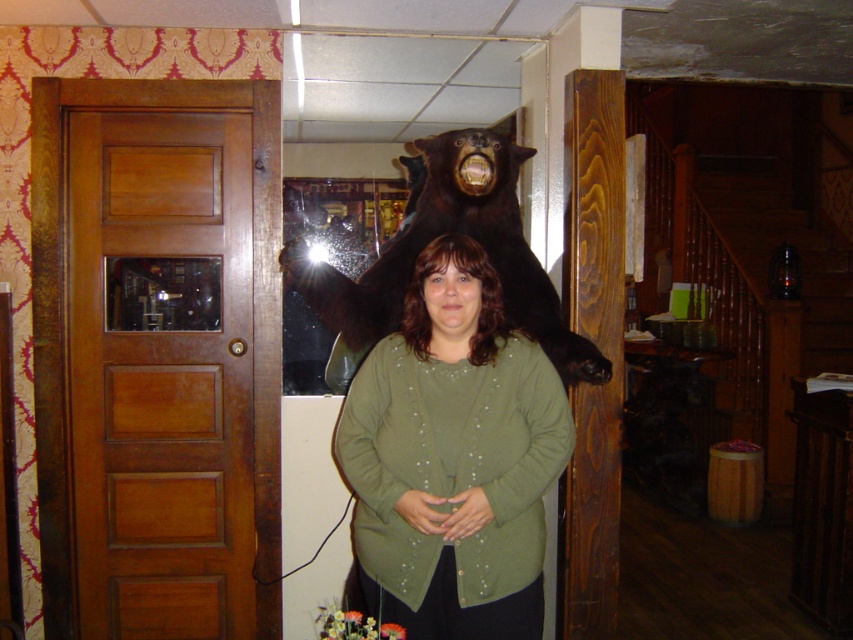
You are a tailor measuring the distance between two garments displayed in a store window. The garments are the olive green sweater at center and the matte green shirt at center. The store requires that items must be at least 10 inches apart for proper display. Based on the scene, is the current spacing between them sufficient?

The distance between the olive green sweater at center and the matte green shirt at center is 8.27 inches, which is less than the required 10 inches. Therefore, the current spacing is insufficient and needs adjustment to meet the store requirements.